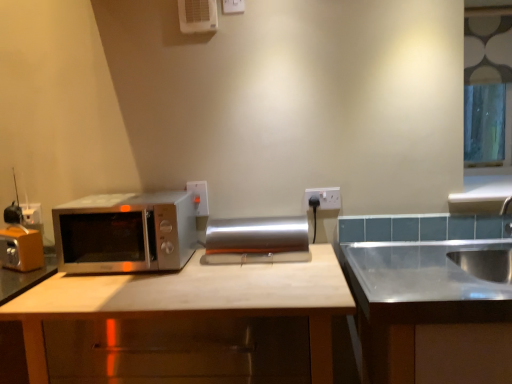
Question: Considering the positions of clear glass window at upper right and satin silver microwave at left in the image, is clear glass window at upper right bigger or smaller than satin silver microwave at left?

Choices:
 (A) big
 (B) small

Answer: (B)

Question: Choose the correct answer: Is clear glass window at upper right inside satin silver microwave at left or outside it?

Choices:
 (A) outside
 (B) inside

Answer: (A)

Question: Estimate the real-world distances between objects in this image. Which object is farther from the white plastic electric outlet at upper right?

Choices:
 (A) clear glass window at upper right
 (B) matte wood cabinet at center, marked as the 1th cabinetry in a left-to-right arrangement
 (C) satin silver sink at right, the second cabinetry viewed from the left
 (D) white plastic air conditioner at upper center
 (E) silver metallic paper towel holder at center

Answer: (A)

Question: Which object is positioned farthest from the white plastic electric outlet at upper right?

Choices:
 (A) matte wood cabinet at center, marked as the 1th cabinetry in a left-to-right arrangement
 (B) white plastic air conditioner at upper center
 (C) satin silver sink at right, the second cabinetry viewed from the left
 (D) satin silver microwave at left
 (E) silver metallic paper towel holder at center

Answer: (B)